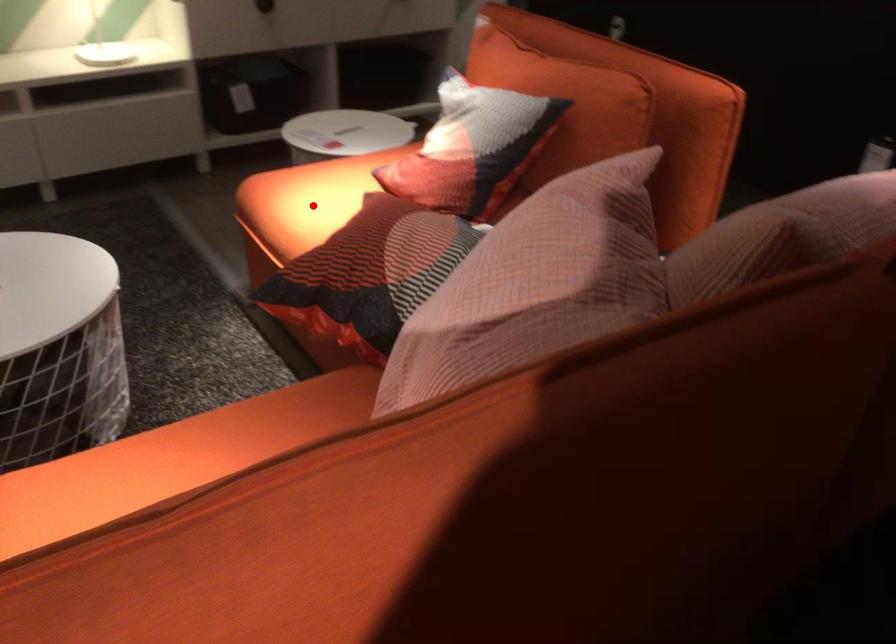
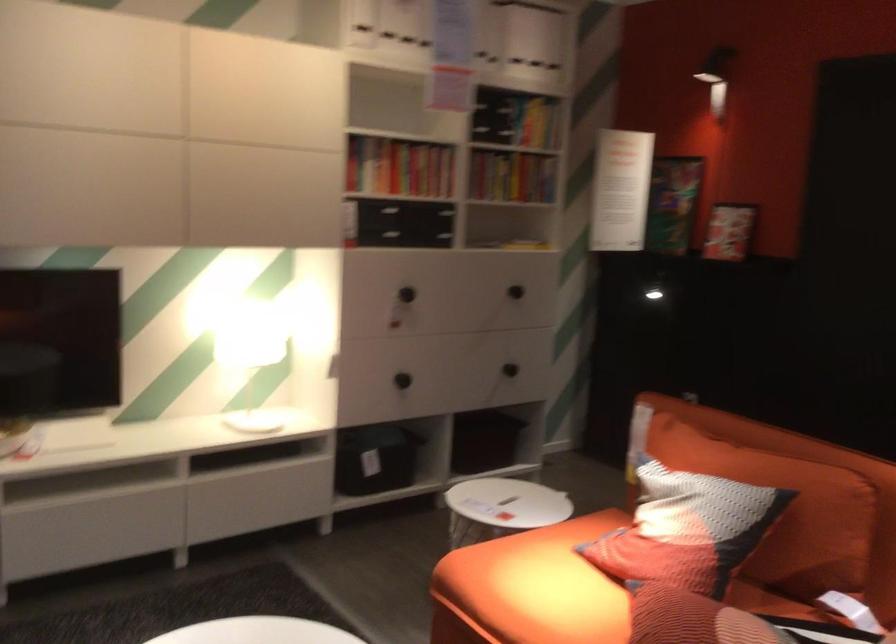
Locate, in the second image, the point that corresponds to the highlighted location in the first image.

(531, 588)